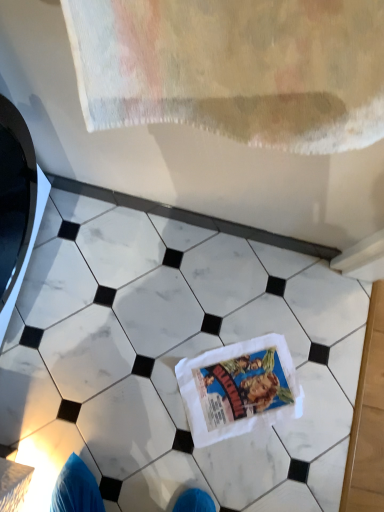
Question: In terms of width, does white marble tile at center look wider or thinner when compared to white cotton comic book at center?

Choices:
 (A) wide
 (B) thin

Answer: (A)

Question: In the image, is white marble tile at center positioned in front of or behind white cotton comic book at center?

Choices:
 (A) front
 (B) behind

Answer: (A)

Question: Would you say white marble tile at center is to the left or to the right of white cotton comic book at center in the picture?

Choices:
 (A) left
 (B) right

Answer: (A)

Question: From the image's perspective, is white cotton comic book at center located above or below white marble tile at center?

Choices:
 (A) below
 (B) above

Answer: (A)

Question: Is point (220, 373) positioned closer to the camera than point (291, 311)?

Choices:
 (A) farther
 (B) closer

Answer: (B)

Question: Would you say white cotton comic book at center is inside or outside white marble tile at center?

Choices:
 (A) inside
 (B) outside

Answer: (A)

Question: Considering the positions of white cotton comic book at center and white marble tile at center in the image, is white cotton comic book at center bigger or smaller than white marble tile at center?

Choices:
 (A) small
 (B) big

Answer: (A)